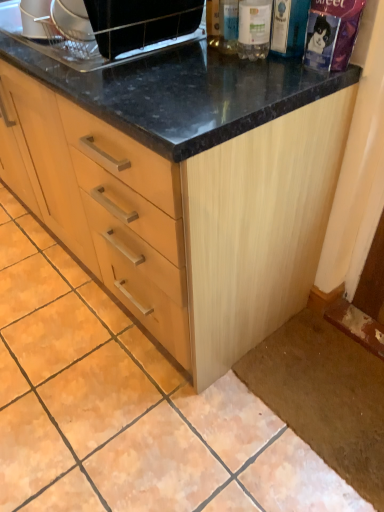
Question: Is transparent plastic bottle at upper right, which is counted as the 1th bottle, starting from the right, closer to camera compared to clear plastic bottle at upper right, the second bottle when ordered from left to right?

Choices:
 (A) yes
 (B) no

Answer: (B)

Question: Is transparent plastic bottle at upper right, acting as the third bottle starting from the left, to the right of clear plastic bottle at upper right, the second bottle when ordered from left to right, from the viewer's perspective?

Choices:
 (A) no
 (B) yes

Answer: (B)

Question: Is clear plastic bottle at upper right, the second bottle when ordered from left to right, inside transparent plastic bottle at upper right, which is counted as the 1th bottle, starting from the right?

Choices:
 (A) yes
 (B) no

Answer: (B)

Question: From a real-world perspective, is transparent plastic bottle at upper right, which is counted as the 1th bottle, starting from the right, physically below clear plastic bottle at upper right, the second bottle when ordered from left to right?

Choices:
 (A) no
 (B) yes

Answer: (B)

Question: From the image's perspective, is transparent plastic bottle at upper right, which is counted as the 1th bottle, starting from the right, beneath clear plastic bottle at upper right, positioned as the second bottle in right-to-left order?

Choices:
 (A) yes
 (B) no

Answer: (A)

Question: Does transparent plastic bottle at upper right, which is counted as the 1th bottle, starting from the right, have a lesser width compared to clear plastic bottle at upper right, the second bottle when ordered from left to right?

Choices:
 (A) no
 (B) yes

Answer: (B)

Question: Is black glossy microwave at upper center oriented towards clear glass bottle at upper center, arranged as the 3th bottle when viewed from the right?

Choices:
 (A) no
 (B) yes

Answer: (A)

Question: Is black glossy microwave at upper center in front of clear glass bottle at upper center, the 1th bottle from the left?

Choices:
 (A) yes
 (B) no

Answer: (A)

Question: Is black glossy microwave at upper center positioned beyond the bounds of clear glass bottle at upper center, arranged as the 3th bottle when viewed from the right?

Choices:
 (A) yes
 (B) no

Answer: (A)

Question: Does black glossy microwave at upper center contain clear glass bottle at upper center, arranged as the 3th bottle when viewed from the right?

Choices:
 (A) no
 (B) yes

Answer: (A)

Question: Does black glossy microwave at upper center have a lesser height compared to clear glass bottle at upper center, the 1th bottle from the left?

Choices:
 (A) no
 (B) yes

Answer: (A)

Question: From a real-world perspective, does black glossy microwave at upper center sit lower than clear glass bottle at upper center, arranged as the 3th bottle when viewed from the right?

Choices:
 (A) no
 (B) yes

Answer: (A)

Question: Is clear plastic bottle at upper right, the second bottle when ordered from left to right, shorter than transparent plastic bottle at upper right, which is counted as the 1th bottle, starting from the right?

Choices:
 (A) yes
 (B) no

Answer: (B)